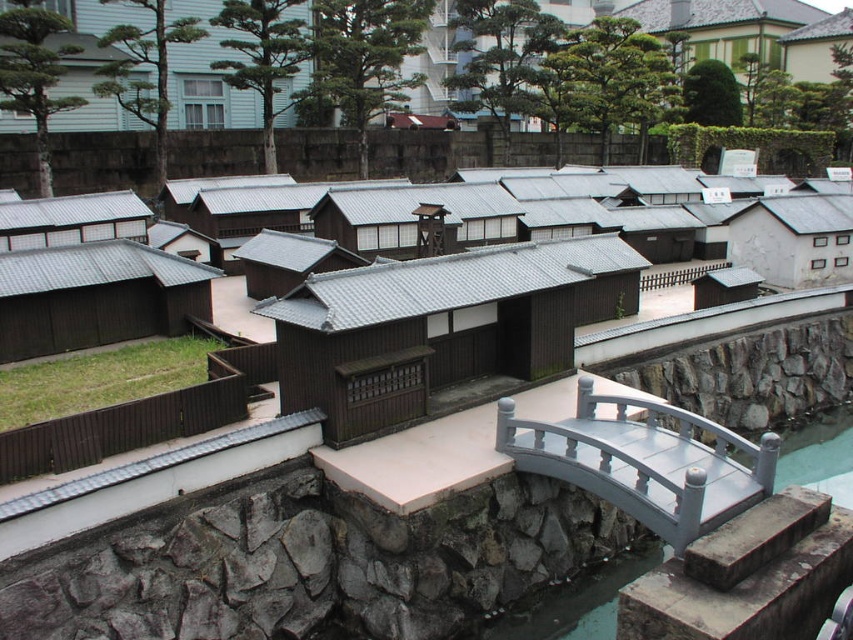
Is point (155, 330) behind point (100, 196)?

That is False.

From the picture: Who is more distant from viewer, (113, 317) or (15, 214)?

The point (15, 214) is more distant.

Which is in front, point (41, 333) or point (55, 227)?

Point (41, 333)

Where is `brown wood hut at lower left`? The height and width of the screenshot is (640, 853). brown wood hut at lower left is located at coordinates (96, 296).

Is matte brown wooden hut at center thinner than white matte building at right?

In fact, matte brown wooden hut at center might be wider than white matte building at right.

Where is `matte brown wooden hut at center`? matte brown wooden hut at center is located at coordinates (442, 330).

Which is behind, point (730, 236) or point (82, 220)?

Point (730, 236)

Looking at this image, can you confirm if white matte building at right is positioned above matte gray roof at left?

No, white matte building at right is not above matte gray roof at left.

Between point (770, 204) and point (4, 218), which one is positioned behind?

Point (770, 204)

This screenshot has height=640, width=853. I want to click on white matte building at right, so click(x=793, y=240).